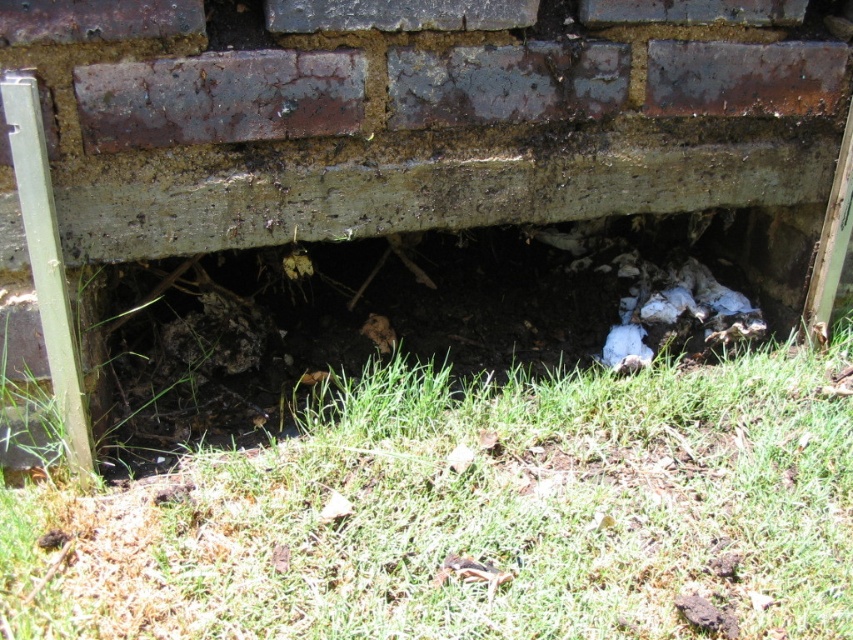
You are a gardener trying to mow the green grass at lower center. However, there is a dull concrete hole at center in the way. Can you mow the grass without hitting the hole?

The green grass at lower center is not as tall as the dull concrete hole at center, so the hole is taller. Therefore, the mower might hit the hole if you try to mow the grass there.

You are standing in front of the brick wall and notice a point marked at coordinates (x=476, y=515). What is located at that point?

The point at coordinates (x=476, y=515) corresponds to green grass at lower center.

You are a surveyor examining the brick wall and its foundation. You notice green grass at lower center. Based on its position, can you determine if the grass is growing closer to the brick wall or the concrete base?

The green grass at lower center is located at point coordinates that place it closer to the concrete base rather than the brick wall. Therefore, the grass is growing nearer to the concrete base.